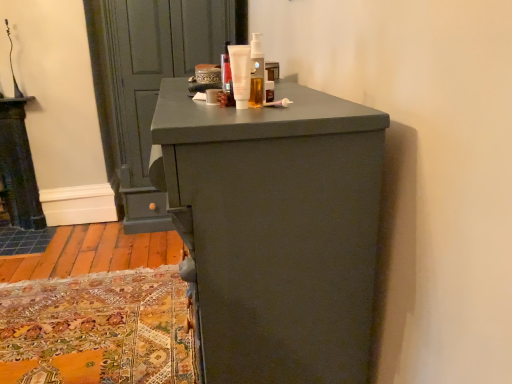
This screenshot has width=512, height=384. I want to click on vacant region to the left of translucent plastic bottle at upper center, which is the 1th toiletry from right to left, so click(195, 109).